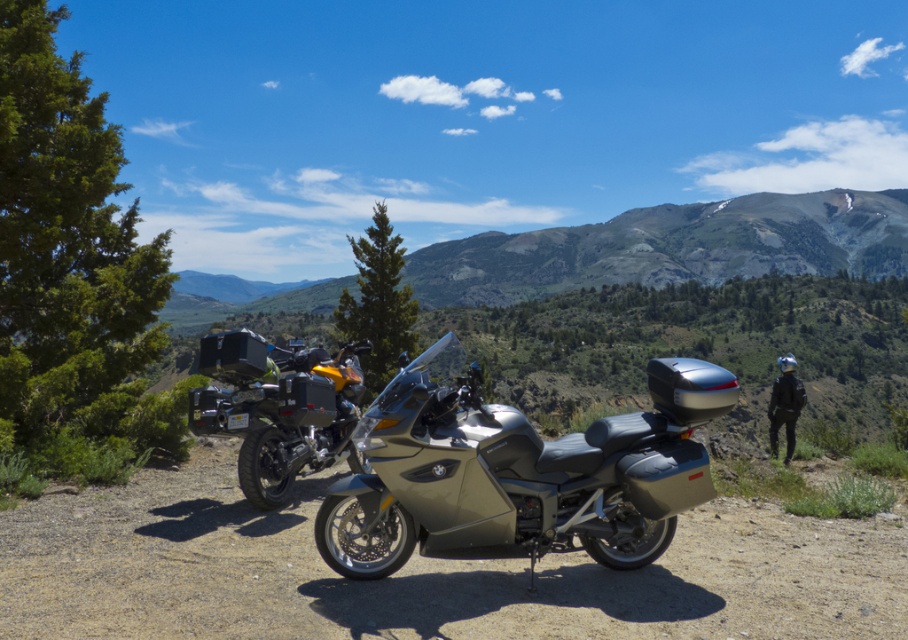
Question: Is gray gravel dirt track at center thinner than green textured mountain at upper center?

Choices:
 (A) yes
 (B) no

Answer: (A)

Question: Considering the real-world distances, which object is farthest from the metallic silver motorcycle at center?

Choices:
 (A) matte black motorcycle at center
 (B) green textured mountain at upper center

Answer: (B)

Question: Considering the relative positions of gray gravel dirt track at center and green textured mountain at upper center in the image provided, where is gray gravel dirt track at center located with respect to green textured mountain at upper center?

Choices:
 (A) below
 (B) above

Answer: (A)

Question: Estimate the real-world distances between objects in this image. Which object is closer to the matte black motorcycle at center?

Choices:
 (A) gray gravel dirt track at center
 (B) metallic silver motorcycle at center

Answer: (A)

Question: Can you confirm if gray gravel dirt track at center is smaller than matte black motorcycle at center?

Choices:
 (A) yes
 (B) no

Answer: (A)

Question: Which of these objects is positioned farthest from the green textured mountain at upper center?

Choices:
 (A) metallic silver motorcycle at center
 (B) matte black motorcycle at center
 (C) gray gravel dirt track at center

Answer: (C)